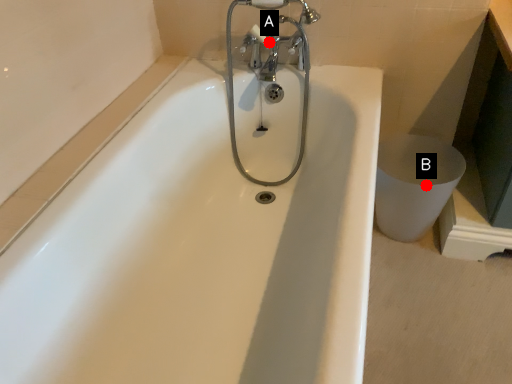
Question: Two points are circled on the image, labeled by A and B beside each circle. Which of the following is the closest to the observer?

Choices:
 (A) A is closer
 (B) B is closer

Answer: (B)